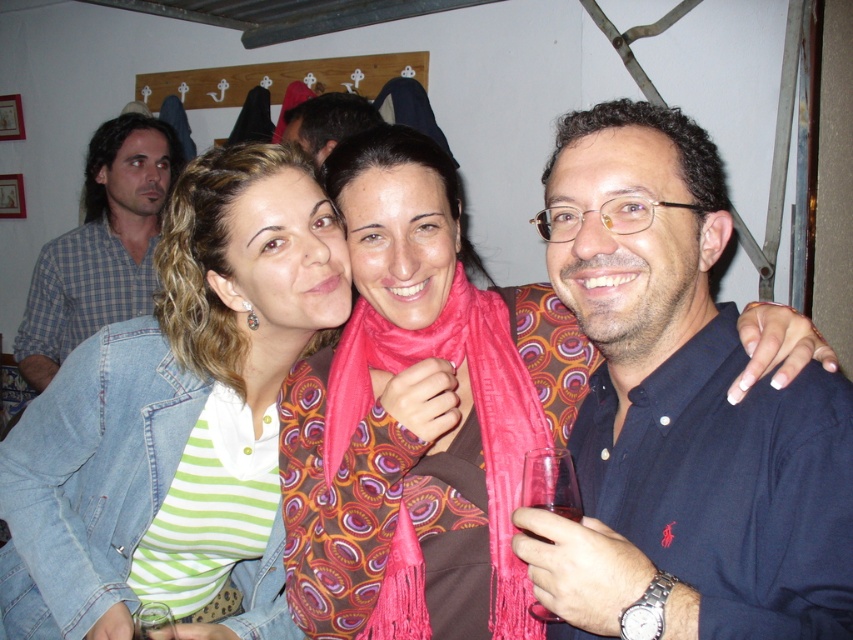
Question: Considering the real-world distances, which object is closest to the dark brown hair at center?

Choices:
 (A) dark blue shirt at right
 (B) denim jacket at left
 (C) pink woven scarf at center
 (D) blue plaid shirt at upper left

Answer: (D)

Question: Can you confirm if denim jacket at left is smaller than blue plaid shirt at upper left?

Choices:
 (A) yes
 (B) no

Answer: (A)

Question: Which object is positioned closest to the pink woven scarf at center?

Choices:
 (A) dark blue shirt at right
 (B) denim jacket at left

Answer: (A)

Question: Is dark blue shirt at right to the right of denim jacket at left from the viewer's perspective?

Choices:
 (A) yes
 (B) no

Answer: (A)

Question: Is dark blue shirt at right smaller than denim jacket at left?

Choices:
 (A) no
 (B) yes

Answer: (B)

Question: Among these objects, which one is farthest from the camera?

Choices:
 (A) dark brown hair at center
 (B) blue plaid shirt at upper left
 (C) pink woven scarf at center
 (D) denim jacket at left

Answer: (B)